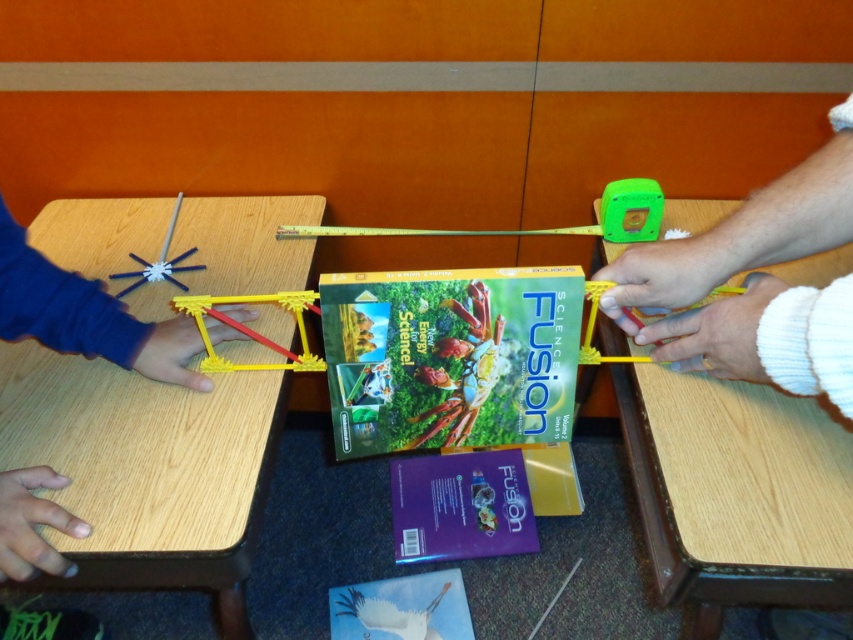
Does white matte bird at center have a lesser width compared to metallic silver starburst at left?

No, white matte bird at center is not thinner than metallic silver starburst at left.

Who is shorter, white matte bird at center or metallic silver starburst at left?

With less height is white matte bird at center.

In order to click on white matte bird at center in this screenshot , I will do `click(390, 614)`.

Can you confirm if yellow plastic frame at center is taller than metallic silver starburst at left?

No.

Who is positioned more to the right, yellow plastic frame at center or metallic silver starburst at left?

yellow plastic frame at center is more to the right.

I want to click on yellow plastic frame at center, so click(252, 330).

Between white fuzzy sweater at right and metallic ruler at center, which one is positioned lower?

white fuzzy sweater at right is below.

Does point (815, 339) come in front of point (450, 232)?

Yes, point (815, 339) is closer to viewer.

You are a GUI agent. You are given a task and a screenshot of the screen. Output one action in this format:
    pyautogui.click(x=<x>, y=<y>)
    Task: Click on the white fuzzy sweater at right
    Image resolution: width=853 pixels, height=640 pixels.
    Given the screenshot: What is the action you would take?
    pyautogui.click(x=755, y=284)